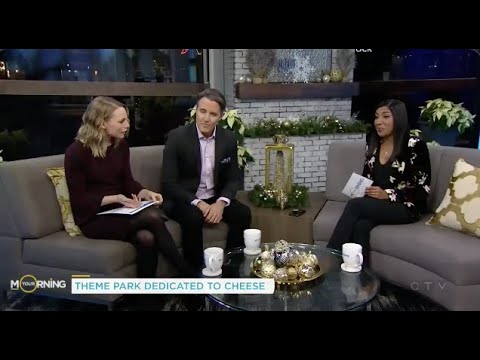
Identify the location of cup handle. This screenshot has height=360, width=480. (212, 265), (361, 262).